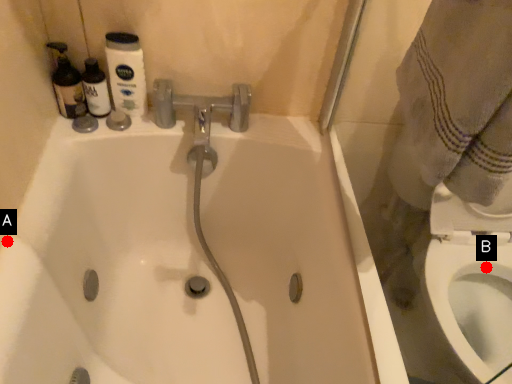
Question: Two points are circled on the image, labeled by A and B beside each circle. Which point is further to the camera?

Choices:
 (A) A is further
 (B) B is further

Answer: (B)